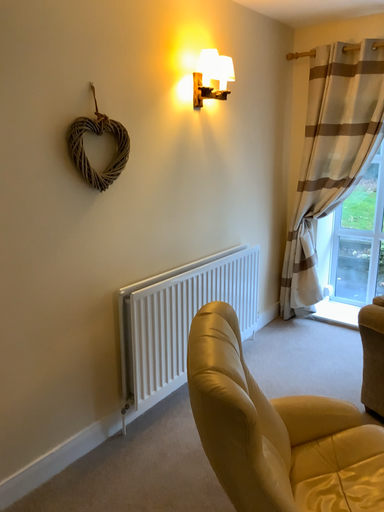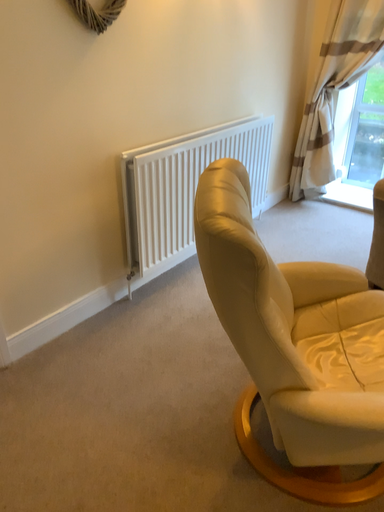
Question: How did the camera likely rotate when shooting the video?

Choices:
 (A) rotated upward
 (B) rotated downward

Answer: (B)